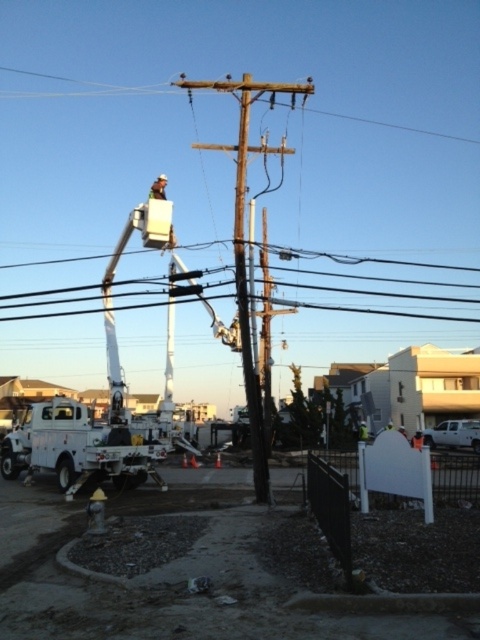
The image size is (480, 640). Describe the element at coordinates (385, 292) in the screenshot. I see `black wire at upper center` at that location.

Is point (467, 289) farther from camera compared to point (156, 179)?

Yes, it is behind point (156, 179).

At what (x,y) coordinates should I click in order to perform the action: click on black wire at upper center. Please return your answer as a coordinate pair (x, y). This screenshot has width=480, height=640. Looking at the image, I should click on (385, 292).

At what (x,y) coordinates should I click in order to perform the action: click on black wire at upper center. Please return your answer as a coordinate pair (x, y). Looking at the image, I should click on (385, 292).

Is brown wooden telegraph pole at center wider than light brown leather helmet at upper center?

Correct, the width of brown wooden telegraph pole at center exceeds that of light brown leather helmet at upper center.

Is brown wooden telegraph pole at center positioned before light brown leather helmet at upper center?

Yes, it is in front of light brown leather helmet at upper center.

Is point (253, 461) positioned in front of point (158, 180)?

Yes, point (253, 461) is closer to viewer.

Locate an element on the screen. This screenshot has width=480, height=640. brown wooden telegraph pole at center is located at coordinates pos(243,246).

Locate an element on the screen. white plastic fire hydrant at lower left is located at coordinates (168, 573).

Is point (238, 552) in front of point (175, 84)?

Yes, point (238, 552) is closer to viewer.

Between point (70, 570) and point (242, 372), which one is positioned in front?

Point (70, 570) is in front.

This screenshot has width=480, height=640. I want to click on white plastic fire hydrant at lower left, so click(168, 573).